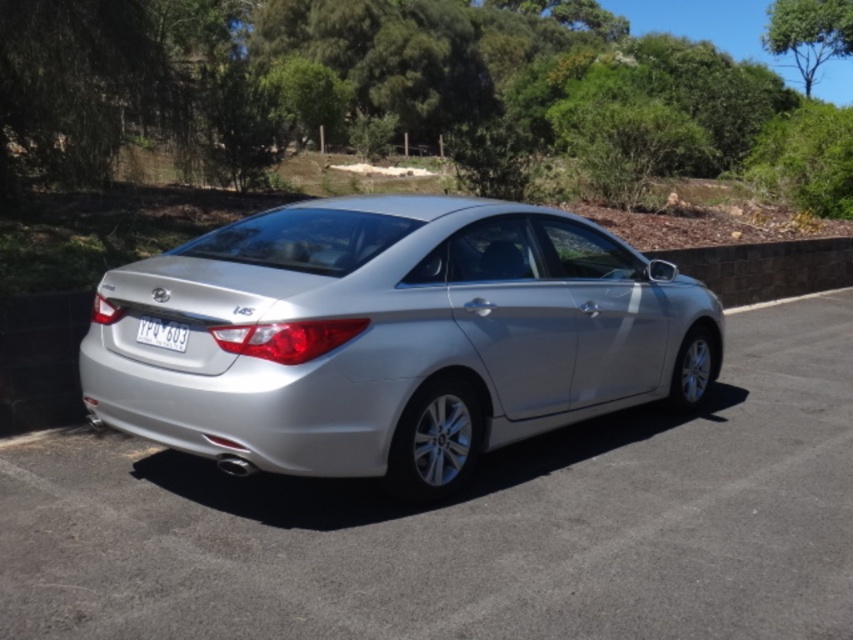
Question: Based on their relative distances, which object is farther from the silver metallic sedan at center?

Choices:
 (A) silver metallic car at center
 (B) white plastic license plate at center

Answer: (A)

Question: Which object is closer to the camera taking this photo?

Choices:
 (A) white plastic license plate at center
 (B) silver metallic car at center

Answer: (A)

Question: Which point is farther to the camera?

Choices:
 (A) (722, 412)
 (B) (143, 316)
 (C) (469, 282)

Answer: (A)

Question: Does silver metallic car at center appear on the right side of white plastic license plate at center?

Choices:
 (A) yes
 (B) no

Answer: (A)

Question: Is the position of silver metallic sedan at center less distant than that of white plastic license plate at center?

Choices:
 (A) no
 (B) yes

Answer: (B)

Question: Does silver metallic sedan at center have a larger size compared to white plastic license plate at center?

Choices:
 (A) no
 (B) yes

Answer: (B)